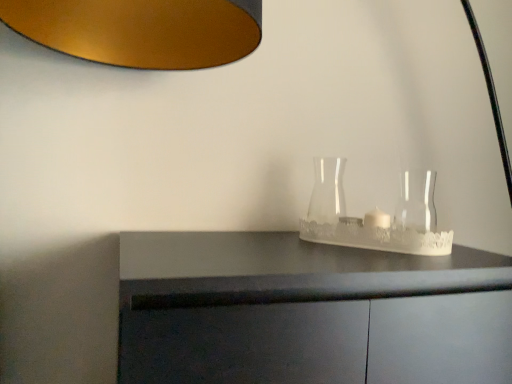
Measure the distance between transparent glass vase at right, which is counted as the first glass vase, starting from the right, and camera.

transparent glass vase at right, which is counted as the first glass vase, starting from the right, and camera are 97.40 centimeters apart from each other.

The width and height of the screenshot is (512, 384). What do you see at coordinates (416, 202) in the screenshot?
I see `transparent glass vase at right, which is counted as the first glass vase, starting from the right` at bounding box center [416, 202].

Find the location of `transparent glass vase at right, which is counted as the first glass vase, starting from the right`. transparent glass vase at right, which is counted as the first glass vase, starting from the right is located at coordinates (416, 202).

Locate an element on the screen. This screenshot has height=384, width=512. transparent glass vase at center, placed as the 1th glass vase when sorted from left to right is located at coordinates (325, 199).

Image resolution: width=512 pixels, height=384 pixels. What do you see at coordinates (325, 199) in the screenshot?
I see `transparent glass vase at center, placed as the 1th glass vase when sorted from left to right` at bounding box center [325, 199].

Where is `transparent glass vase at right, the second glass vase viewed from the left`? transparent glass vase at right, the second glass vase viewed from the left is located at coordinates (416, 202).

Is transparent glass vase at right, which is counted as the first glass vase, starting from the right, to the right of transparent glass vase at center, placed as the 1th glass vase when sorted from left to right, from the viewer's perspective?

Yes, transparent glass vase at right, which is counted as the first glass vase, starting from the right, is to the right of transparent glass vase at center, placed as the 1th glass vase when sorted from left to right.

Considering the positions of objects transparent glass vase at right, which is counted as the first glass vase, starting from the right, and transparent glass vase at center, placed as the 1th glass vase when sorted from left to right, in the image provided, who is behind, transparent glass vase at right, which is counted as the first glass vase, starting from the right, or transparent glass vase at center, placed as the 1th glass vase when sorted from left to right,?

transparent glass vase at center, placed as the 1th glass vase when sorted from left to right.

Considering the positions of points (406, 197) and (324, 171), is point (406, 197) farther from camera compared to point (324, 171)?

Yes, point (406, 197) is farther from viewer.

From the image's perspective, is transparent glass vase at right, which is counted as the first glass vase, starting from the right, below transparent glass vase at center, placed as the 1th glass vase when sorted from left to right?

Yes, from the image's perspective, transparent glass vase at right, which is counted as the first glass vase, starting from the right, is below transparent glass vase at center, placed as the 1th glass vase when sorted from left to right.

From a real-world perspective, which is physically above, transparent glass vase at right, which is counted as the first glass vase, starting from the right, or transparent glass vase at center, placed as the 1th glass vase when sorted from left to right?

transparent glass vase at center, placed as the 1th glass vase when sorted from left to right, is physically above.

Considering the relative sizes of transparent glass vase at right, the second glass vase viewed from the left, and transparent glass vase at center, the second glass vase positioned from the right, in the image provided, is transparent glass vase at right, the second glass vase viewed from the left, wider than transparent glass vase at center, the second glass vase positioned from the right,?

No, transparent glass vase at right, the second glass vase viewed from the left, is not wider than transparent glass vase at center, the second glass vase positioned from the right.

Who is taller, transparent glass vase at right, which is counted as the first glass vase, starting from the right, or transparent glass vase at center, placed as the 1th glass vase when sorted from left to right?

With more height is transparent glass vase at center, placed as the 1th glass vase when sorted from left to right.

Is transparent glass vase at right, which is counted as the first glass vase, starting from the right, smaller than transparent glass vase at center, placed as the 1th glass vase when sorted from left to right?

Yes, transparent glass vase at right, which is counted as the first glass vase, starting from the right, is smaller than transparent glass vase at center, placed as the 1th glass vase when sorted from left to right.

Is transparent glass vase at right, which is counted as the first glass vase, starting from the right, not inside transparent glass vase at center, the second glass vase positioned from the right?

Yes.

Is transparent glass vase at right, which is counted as the first glass vase, starting from the right, with transparent glass vase at center, placed as the 1th glass vase when sorted from left to right?

No, transparent glass vase at right, which is counted as the first glass vase, starting from the right, is not with transparent glass vase at center, placed as the 1th glass vase when sorted from left to right.

Is transparent glass vase at center, the second glass vase positioned from the right, at the back of transparent glass vase at right, the second glass vase viewed from the left?

transparent glass vase at right, the second glass vase viewed from the left, is not turned away from transparent glass vase at center, the second glass vase positioned from the right.

From the picture: How many degrees apart are the facing directions of transparent glass vase at right, the second glass vase viewed from the left, and transparent glass vase at center, the second glass vase positioned from the right?

0.00111 degrees separate the facing orientations of transparent glass vase at right, the second glass vase viewed from the left, and transparent glass vase at center, the second glass vase positioned from the right.

There is a transparent glass vase at right, which is counted as the first glass vase, starting from the right. Where is `glass vase above it (from a real-world perspective)`? glass vase above it (from a real-world perspective) is located at coordinates (325, 199).

Would you say transparent glass vase at center, placed as the 1th glass vase when sorted from left to right, is to the left or to the right of transparent glass vase at right, which is counted as the first glass vase, starting from the right, in the picture?

transparent glass vase at center, placed as the 1th glass vase when sorted from left to right, is to the left of transparent glass vase at right, which is counted as the first glass vase, starting from the right.

Between transparent glass vase at center, the second glass vase positioned from the right, and transparent glass vase at right, which is counted as the first glass vase, starting from the right, which one is positioned in front?

transparent glass vase at right, which is counted as the first glass vase, starting from the right, is more forward.

Considering the positions of points (334, 182) and (408, 183), is point (334, 182) closer to camera compared to point (408, 183)?

Yes, it is in front of point (408, 183).

From the image's perspective, which one is positioned lower, transparent glass vase at center, placed as the 1th glass vase when sorted from left to right, or transparent glass vase at right, which is counted as the first glass vase, starting from the right?

From the image's view, transparent glass vase at right, which is counted as the first glass vase, starting from the right, is below.

Looking at this image, from a real-world perspective, is transparent glass vase at center, the second glass vase positioned from the right, on transparent glass vase at right, which is counted as the first glass vase, starting from the right?

Correct, in the physical world, transparent glass vase at center, the second glass vase positioned from the right, is higher than transparent glass vase at right, which is counted as the first glass vase, starting from the right.

Considering the sizes of objects transparent glass vase at center, the second glass vase positioned from the right, and transparent glass vase at right, which is counted as the first glass vase, starting from the right, in the image provided, who is thinner, transparent glass vase at center, the second glass vase positioned from the right, or transparent glass vase at right, which is counted as the first glass vase, starting from the right,?

Thinner between the two is transparent glass vase at right, which is counted as the first glass vase, starting from the right.

Between transparent glass vase at center, the second glass vase positioned from the right, and transparent glass vase at right, which is counted as the first glass vase, starting from the right, which one has more height?

With more height is transparent glass vase at center, the second glass vase positioned from the right.

Which of these two, transparent glass vase at center, the second glass vase positioned from the right, or transparent glass vase at right, which is counted as the first glass vase, starting from the right, is smaller?

transparent glass vase at right, which is counted as the first glass vase, starting from the right.

Is transparent glass vase at center, the second glass vase positioned from the right, inside the boundaries of transparent glass vase at right, which is counted as the first glass vase, starting from the right, or outside?

transparent glass vase at center, the second glass vase positioned from the right, is not inside transparent glass vase at right, which is counted as the first glass vase, starting from the right, it's outside.

In the scene shown: Are transparent glass vase at center, the second glass vase positioned from the right, and transparent glass vase at right, which is counted as the first glass vase, starting from the right, beside each other?

No, transparent glass vase at center, the second glass vase positioned from the right, is not in contact with transparent glass vase at right, which is counted as the first glass vase, starting from the right.

From the picture: Could you tell me if transparent glass vase at center, the second glass vase positioned from the right, is turned towards transparent glass vase at right, which is counted as the first glass vase, starting from the right?

No, transparent glass vase at center, the second glass vase positioned from the right, is not facing towards transparent glass vase at right, which is counted as the first glass vase, starting from the right.

How different are the orientations of transparent glass vase at center, placed as the 1th glass vase when sorted from left to right, and transparent glass vase at right, which is counted as the first glass vase, starting from the right, in degrees?

There is a 0.00111-degree angle between the facing directions of transparent glass vase at center, placed as the 1th glass vase when sorted from left to right, and transparent glass vase at right, which is counted as the first glass vase, starting from the right.

Locate an element on the screen. This screenshot has height=384, width=512. glass vase below the transparent glass vase at center, the second glass vase positioned from the right (from a real-world perspective) is located at coordinates (416, 202).

Find the location of a particular element. glass vase below the transparent glass vase at center, placed as the 1th glass vase when sorted from left to right (from the image's perspective) is located at coordinates (416, 202).

Where is `glass vase that is behind the transparent glass vase at right, the second glass vase viewed from the left`? The image size is (512, 384). glass vase that is behind the transparent glass vase at right, the second glass vase viewed from the left is located at coordinates (325, 199).